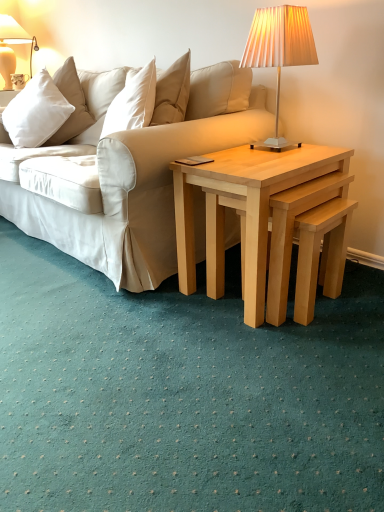
Locate an element on the screen. This screenshot has height=512, width=384. vacant area to the left of light wood/natural wood nesting tables at center is located at coordinates (147, 312).